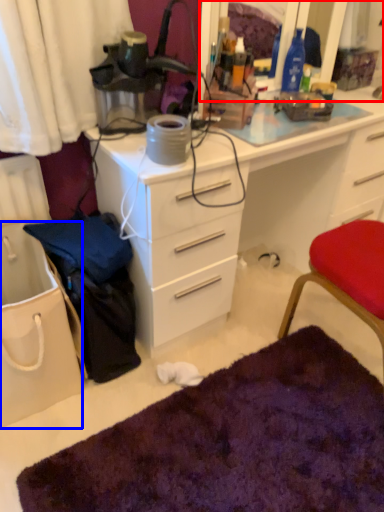
Question: Which point is closer to the camera, mirror (highlighted by a red box) or handbag (highlighted by a blue box)?

Choices:
 (A) mirror
 (B) handbag

Answer: (B)